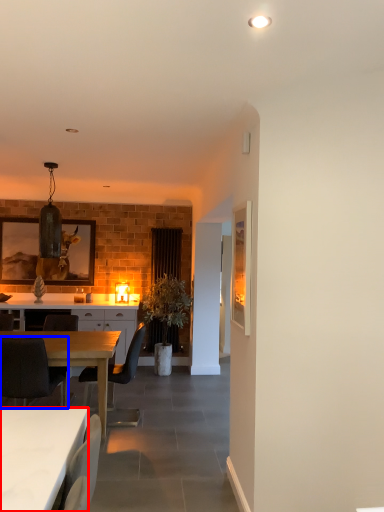
Question: Which point is closer to the camera, desk (highlighted by a red box) or chair (highlighted by a blue box)?

Choices:
 (A) desk
 (B) chair

Answer: (A)